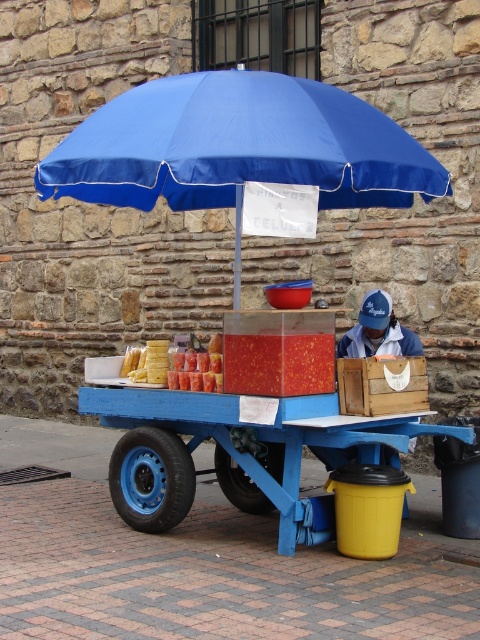
Question: Which point is farther to the camera?

Choices:
 (A) (267, 456)
 (B) (316, 109)

Answer: (A)

Question: Is blue fabric umbrella at upper center positioned in front of blue wooden cart at center?

Choices:
 (A) yes
 (B) no

Answer: (A)

Question: Which object appears farthest from the camera in this image?

Choices:
 (A) blue fabric umbrella at upper center
 (B) blue wooden cart at center
 (C) wooden crate at center

Answer: (C)

Question: Which object appears closest to the camera in this image?

Choices:
 (A) blue wooden cart at center
 (B) wooden crate at center
 (C) blue fabric umbrella at upper center

Answer: (C)

Question: Does blue fabric umbrella at upper center lie in front of wooden crate at center?

Choices:
 (A) yes
 (B) no

Answer: (A)

Question: Is blue fabric umbrella at upper center thinner than wooden crate at center?

Choices:
 (A) yes
 (B) no

Answer: (B)